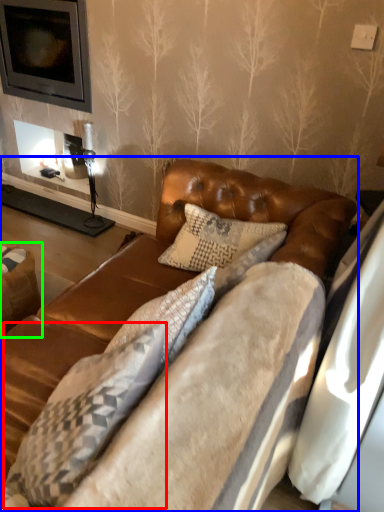
Question: Which is farther away from pillow (highlighted by a red box)? studio couch (highlighted by a blue box) or swivel chair (highlighted by a green box)?

Choices:
 (A) studio couch
 (B) swivel chair

Answer: (B)